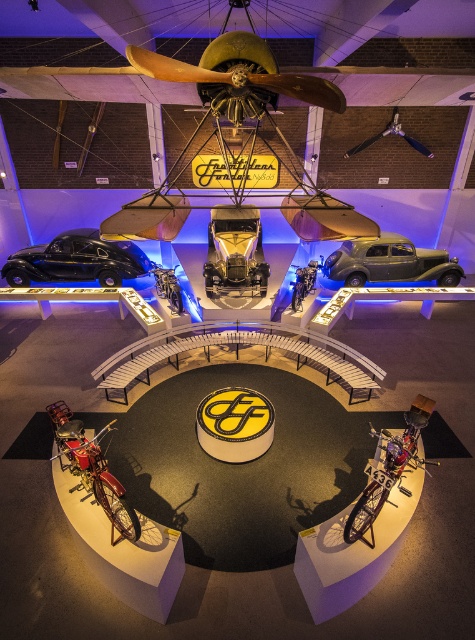
You are a visitor standing in the middle of the exhibition hall. You see the shiny black car at left and the matte silver car at center. Which car is positioned higher in elevation?

The shiny black car at left is located above the matte silver car at center, so it is positioned higher in elevation.

You are a visitor at the exhibition and want to take a photo of both the gold metallic car at center and the metallic silver propeller at center. If your camera can only focus on objects within a 1.2 meter height range, will both objects be in focus at the same time?

The gold metallic car at center is taller than the metallic silver propeller at center. Since the camera can focus on objects within a 1.2 meter height range, if the height difference between them is less than or equal to 1.2 meters, they can be in focus. However, without knowing the exact height of each object, we cannot definitively answer if they will be in focus together.